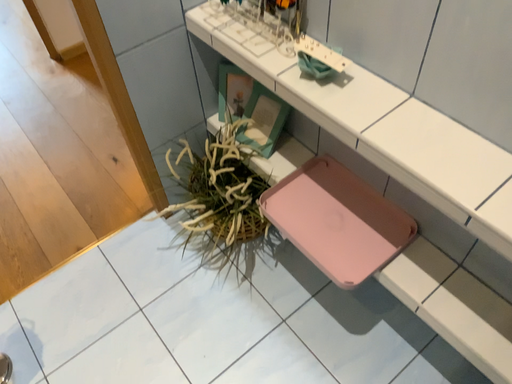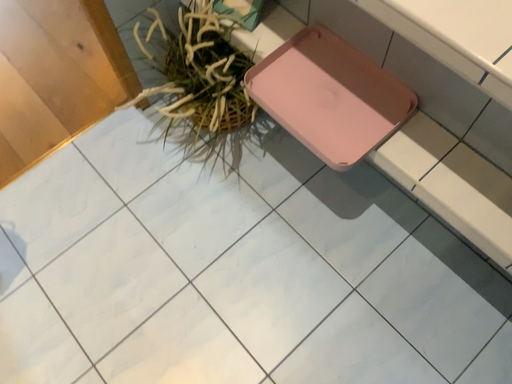
Question: How did the camera likely rotate when shooting the video?

Choices:
 (A) rotated upward
 (B) rotated downward

Answer: (B)